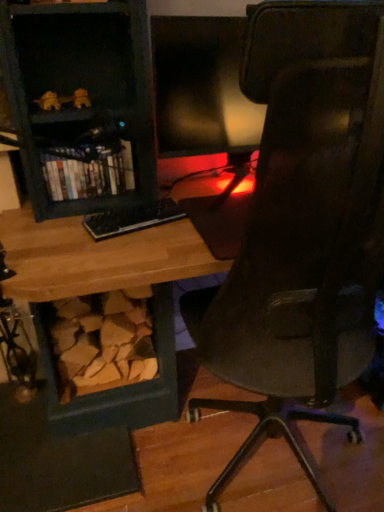
Question: Can you confirm if matte black monitor at center is taller than matte black bookshelf at left?

Choices:
 (A) no
 (B) yes

Answer: (B)

Question: Is matte black monitor at center further to the viewer compared to matte black bookshelf at left?

Choices:
 (A) yes
 (B) no

Answer: (B)

Question: Could you tell me if matte black monitor at center is facing matte black bookshelf at left?

Choices:
 (A) yes
 (B) no

Answer: (B)

Question: Is matte black monitor at center in front of matte black bookshelf at left?

Choices:
 (A) yes
 (B) no

Answer: (A)

Question: Is matte black monitor at center far from matte black bookshelf at left?

Choices:
 (A) no
 (B) yes

Answer: (A)

Question: From the image's perspective, is matte black monitor at center located above or below black plastic keyboard at center?

Choices:
 (A) above
 (B) below

Answer: (A)

Question: From a real-world perspective, relative to black plastic keyboard at center, is matte black monitor at center vertically above or below?

Choices:
 (A) below
 (B) above

Answer: (B)

Question: Considering the positions of matte black monitor at center and black plastic keyboard at center in the image, is matte black monitor at center taller or shorter than black plastic keyboard at center?

Choices:
 (A) tall
 (B) short

Answer: (A)

Question: In the image, is matte black monitor at center positioned in front of or behind black plastic keyboard at center?

Choices:
 (A) behind
 (B) front

Answer: (B)

Question: Is black plastic keyboard at center inside or outside of matte black bookshelf at left?

Choices:
 (A) inside
 (B) outside

Answer: (B)

Question: From the image's perspective, is black plastic keyboard at center located above or below matte black bookshelf at left?

Choices:
 (A) below
 (B) above

Answer: (A)

Question: Based on their sizes in the image, would you say black plastic keyboard at center is bigger or smaller than matte black bookshelf at left?

Choices:
 (A) small
 (B) big

Answer: (A)

Question: Considering the relative positions of black plastic keyboard at center and matte black bookshelf at left in the image provided, is black plastic keyboard at center to the left or to the right of matte black bookshelf at left?

Choices:
 (A) right
 (B) left

Answer: (A)

Question: In terms of size, does matte black bookshelf at left appear bigger or smaller than black plastic keyboard at center?

Choices:
 (A) big
 (B) small

Answer: (A)

Question: Is matte black bookshelf at left to the left or to the right of black plastic keyboard at center in the image?

Choices:
 (A) right
 (B) left

Answer: (B)